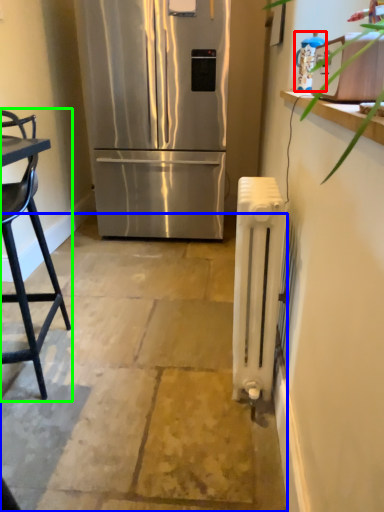
Question: Which is nearer to the appliance (highlighted by a red box)? concrete (highlighted by a blue box) or chair (highlighted by a green box).

Choices:
 (A) concrete
 (B) chair

Answer: (B)